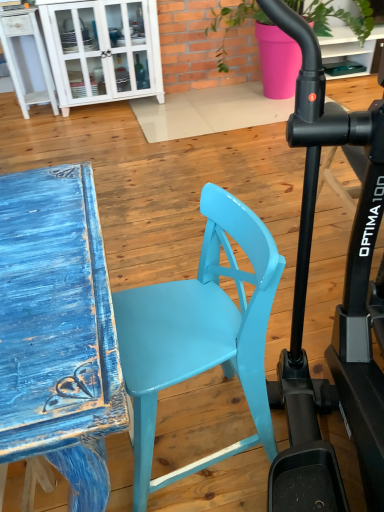
Find the location of a particular element. The image size is (384, 512). matte pink pot at upper center is located at coordinates (336, 17).

Is matte pink pot at upper center positioned far away from glossy plastic chair at center?

Yes, matte pink pot at upper center and glossy plastic chair at center are located far from each other.

Which object is thinner, matte pink pot at upper center or glossy plastic chair at center?

glossy plastic chair at center.

Which of these two, matte pink pot at upper center or glossy plastic chair at center, stands shorter?

Standing shorter between the two is glossy plastic chair at center.

Is matte pink pot at upper center in front of or behind white glossy cabinet at upper left in the image?

matte pink pot at upper center is in front of white glossy cabinet at upper left.

Would you consider matte pink pot at upper center to be distant from white glossy cabinet at upper left?

Absolutely, matte pink pot at upper center is distant from white glossy cabinet at upper left.

Which is in front, point (324, 28) or point (115, 74)?

The point (115, 74) is closer to the camera.

Based on their positions, is matte pink pot at upper center located to the left or right of white glossy cabinet at upper left?

matte pink pot at upper center is to the right of white glossy cabinet at upper left.

From the image's perspective, who appears lower, glossy plastic chair at center or white glossy cabinet at upper left?

glossy plastic chair at center appears lower in the image.

Is the depth of glossy plastic chair at center less than that of white glossy cabinet at upper left?

That is True.

Is glossy plastic chair at center inside or outside of white glossy cabinet at upper left?

glossy plastic chair at center exists outside the volume of white glossy cabinet at upper left.

From the image's perspective, does white glossy cabinet at upper left appear higher than matte pink pot at upper center?

No, from the image's perspective, white glossy cabinet at upper left is not above matte pink pot at upper center.

Is white glossy cabinet at upper left next to matte pink pot at upper center?

They are not placed beside each other.

Can you confirm if glossy plastic chair at center is thinner than matte pink pot at upper center?

Yes, glossy plastic chair at center is thinner than matte pink pot at upper center.

How many degrees apart are the facing directions of glossy plastic chair at center and matte pink pot at upper center?

The angular difference between glossy plastic chair at center and matte pink pot at upper center is 86.6 degrees.

Is glossy plastic chair at center not within matte pink pot at upper center?

Indeed, glossy plastic chair at center is completely outside matte pink pot at upper center.

Considering the relative positions of glossy plastic chair at center and matte pink pot at upper center in the image provided, is glossy plastic chair at center to the right of matte pink pot at upper center from the viewer's perspective?

No.

Considering the positions of point (61, 29) and point (229, 305), is point (61, 29) closer or farther from the camera than point (229, 305)?

Point (61, 29).

From the image's perspective, is white glossy cabinet at upper left located above or below glossy plastic chair at center?

white glossy cabinet at upper left is above glossy plastic chair at center.

Find the location of a particular element. This screenshot has width=384, height=512. cabinetry above the glossy plastic chair at center (from a real-world perspective) is located at coordinates (103, 50).

Can you confirm if white glossy cabinet at upper left is positioned to the right of glossy plastic chair at center?

In fact, white glossy cabinet at upper left is to the left of glossy plastic chair at center.

The width and height of the screenshot is (384, 512). In order to click on chair on the left of matte pink pot at upper center in this screenshot , I will do `click(200, 334)`.

Find the location of a particular element. This screenshot has width=384, height=512. plant lying on the right of white glossy cabinet at upper left is located at coordinates (336, 17).

From the image, which object appears to be nearer to white glossy cabinet at upper left, matte pink pot at upper center or glossy plastic chair at center?

The object closer to white glossy cabinet at upper left is matte pink pot at upper center.

Based on their spatial positions, is glossy plastic chair at center or white glossy cabinet at upper left further from matte pink pot at upper center?

glossy plastic chair at center.

Estimate the real-world distances between objects in this image. Which object is closer to matte pink pot at upper center, white glossy cabinet at upper left or glossy plastic chair at center?

white glossy cabinet at upper left lies closer to matte pink pot at upper center than the other object.

Based on their spatial positions, is matte pink pot at upper center or white glossy cabinet at upper left closer to glossy plastic chair at center?

white glossy cabinet at upper left is closer to glossy plastic chair at center.

Which object lies further to the anchor point white glossy cabinet at upper left, glossy plastic chair at center or matte pink pot at upper center?

The object further to white glossy cabinet at upper left is glossy plastic chair at center.

From the image, which object appears to be farther from glossy plastic chair at center, white glossy cabinet at upper left or matte pink pot at upper center?

matte pink pot at upper center is further to glossy plastic chair at center.

I want to click on plant between glossy plastic chair at center and white glossy cabinet at upper left in the front-back direction, so pos(336,17).